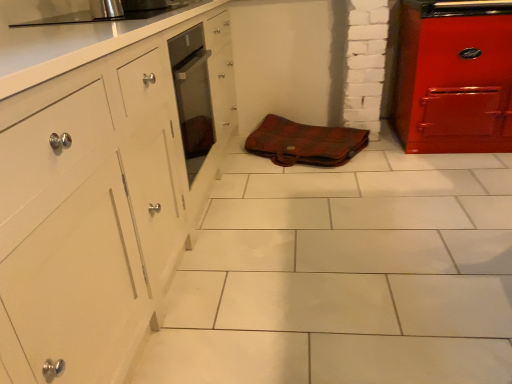
The width and height of the screenshot is (512, 384). What do you see at coordinates (106, 9) in the screenshot?
I see `brushed metal oven at upper center` at bounding box center [106, 9].

The height and width of the screenshot is (384, 512). I want to click on brushed metal oven at upper center, so click(106, 9).

Measure the distance between brown leather bag at center and camera.

brown leather bag at center and camera are 2.45 meters apart.

What do you see at coordinates (305, 143) in the screenshot? I see `brown leather bag at center` at bounding box center [305, 143].

What are the coordinates of `brown leather bag at center` in the screenshot? It's located at (305, 143).

Locate an element on the screen. brushed metal oven at upper center is located at coordinates (106, 9).

Based on their positions, is brushed metal oven at upper center located to the left or right of brown leather bag at center?

In the image, brushed metal oven at upper center appears on the left side of brown leather bag at center.

Which object is further away from the camera taking this photo, brushed metal oven at upper center or brown leather bag at center?

brown leather bag at center is further away from the camera.

Is point (120, 15) closer to viewer compared to point (254, 145)?

Yes, point (120, 15) is closer to viewer.

From the image's perspective, is brushed metal oven at upper center above or below brown leather bag at center?

Based on their image positions, brushed metal oven at upper center is located above brown leather bag at center.

From a real-world perspective, is brushed metal oven at upper center positioned under brown leather bag at center based on gravity?

No, from a real-world perspective, brushed metal oven at upper center is not beneath brown leather bag at center.

Which of these two, brushed metal oven at upper center or brown leather bag at center, is thinner?

brushed metal oven at upper center is thinner.

Considering the relative sizes of brushed metal oven at upper center and brown leather bag at center in the image provided, is brushed metal oven at upper center shorter than brown leather bag at center?

No, brushed metal oven at upper center is not shorter than brown leather bag at center.

Does brushed metal oven at upper center have a smaller size compared to brown leather bag at center?

Yes, brushed metal oven at upper center is smaller than brown leather bag at center.

Is brushed metal oven at upper center positioned beyond the bounds of brown leather bag at center?

brushed metal oven at upper center lies outside brown leather bag at center's area.

Is brushed metal oven at upper center placed right next to brown leather bag at center?

brushed metal oven at upper center is not next to brown leather bag at center, and they're not touching.

Could you tell me if brushed metal oven at upper center is facing brown leather bag at center?

No, brushed metal oven at upper center does not turn towards brown leather bag at center.

What's the angular difference between brushed metal oven at upper center and brown leather bag at center's facing directions?

They differ by 113 degrees in their facing directions.

How far apart are brushed metal oven at upper center and brown leather bag at center?

brushed metal oven at upper center and brown leather bag at center are 1.37 meters apart.

Locate an element on the screen. The height and width of the screenshot is (384, 512). appliance that is above the brown leather bag at center (from a real-world perspective) is located at coordinates (106, 9).

Which object is positioned more to the right, brown leather bag at center or brushed metal oven at upper center?

brown leather bag at center.

Who is more distant, brown leather bag at center or brushed metal oven at upper center?

Positioned behind is brown leather bag at center.

Considering the positions of point (367, 144) and point (91, 16), is point (367, 144) closer or farther from the camera than point (91, 16)?

Clearly, point (367, 144) is more distant from the camera than point (91, 16).

From the image's perspective, which object appears higher, brown leather bag at center or brushed metal oven at upper center?

brushed metal oven at upper center.

From a real-world perspective, is brown leather bag at center physically below brushed metal oven at upper center?

Yes, from a real-world perspective, brown leather bag at center is beneath brushed metal oven at upper center.

Which object is wider, brown leather bag at center or brushed metal oven at upper center?

brown leather bag at center is wider.

Which of these two, brown leather bag at center or brushed metal oven at upper center, stands taller?

brushed metal oven at upper center.

Does brown leather bag at center have a smaller size compared to brushed metal oven at upper center?

Incorrect, brown leather bag at center is not smaller in size than brushed metal oven at upper center.

Is brown leather bag at center inside or outside of brushed metal oven at upper center?

brown leather bag at center is spatially situated outside brushed metal oven at upper center.

Is brown leather bag at center placed right next to brushed metal oven at upper center?

brown leather bag at center is not next to brushed metal oven at upper center, and they're not touching.

Is brown leather bag at center facing away from brushed metal oven at upper center?

brown leather bag at center is not turned away from brushed metal oven at upper center.

How many degrees apart are the facing directions of brown leather bag at center and brushed metal oven at upper center?

The angular difference between brown leather bag at center and brushed metal oven at upper center is 113 degrees.

In the image, there is a brushed metal oven at upper center. At what (x,y) coordinates should I click in order to perform the action: click on material below it (from a real-world perspective). Please return your answer as a coordinate pair (x, y). Image resolution: width=512 pixels, height=384 pixels. Looking at the image, I should click on (305, 143).

You are a GUI agent. You are given a task and a screenshot of the screen. Output one action in this format:
    pyautogui.click(x=<x>, y=<y>)
    Task: Click on the appliance above the brown leather bag at center (from a real-world perspective)
    
    Given the screenshot: What is the action you would take?
    pyautogui.click(x=106, y=9)

Locate an element on the screen. appliance in front of the brown leather bag at center is located at coordinates pyautogui.click(x=106, y=9).